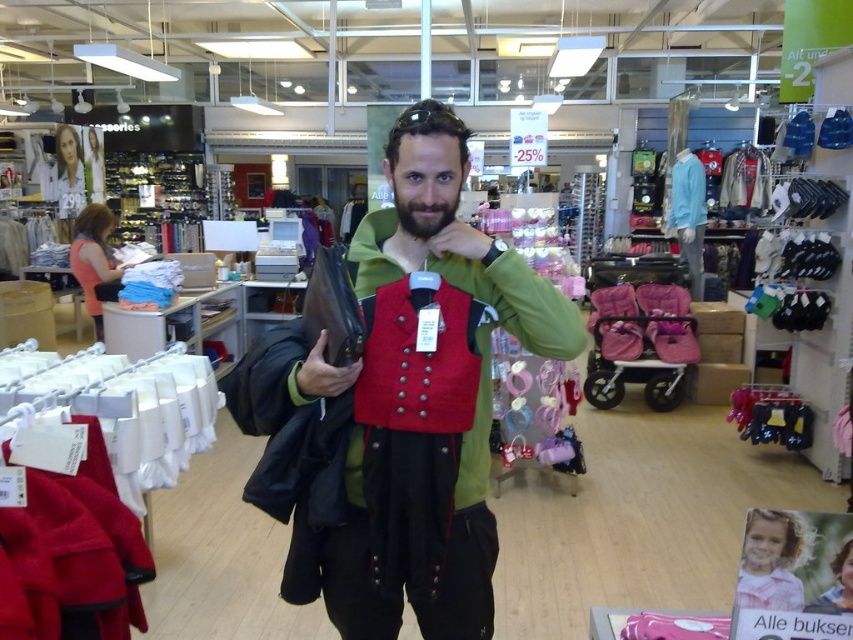
Can you confirm if matte red vest at center is smaller than beardhairjaw at center?

No, matte red vest at center is not smaller than beardhairjaw at center.

Between point (479, 323) and point (456, 195), which one is positioned in front?

Point (456, 195) is more forward.

Describe the element at coordinates (424, 426) in the screenshot. I see `matte red vest at center` at that location.

This screenshot has height=640, width=853. In order to click on matte red vest at center in this screenshot , I will do `click(424, 426)`.